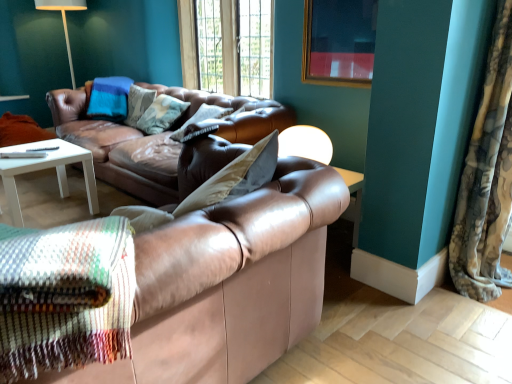
Identify the location of leather couch at center, marked as the 1th studio couch in a front-to-back arrangement. (229, 283).

Where is `fluffy fabric curtain at right`? This screenshot has height=384, width=512. fluffy fabric curtain at right is located at coordinates point(487,178).

The image size is (512, 384). Describe the element at coordinates (227, 46) in the screenshot. I see `wooden frame at upper center` at that location.

What do you see at coordinates (128, 152) in the screenshot?
I see `leather couch at center, which is the 1th studio couch from back to front` at bounding box center [128, 152].

At what (x,y) coordinates should I click in order to perform the action: click on gold-framed picture at upper center. Please return your answer as a coordinate pair (x, y). Looking at the image, I should click on (339, 42).

Describe the element at coordinates (201, 118) in the screenshot. The image size is (512, 384). I see `leather pillow at center` at that location.

Where is `matte white table lamp at center`? This screenshot has width=512, height=384. matte white table lamp at center is located at coordinates (305, 143).

Would you say leather couch at center, which ranks as the 2th studio couch in back-to-front order, is inside or outside fluffy fabric curtain at right?

leather couch at center, which ranks as the 2th studio couch in back-to-front order, is not enclosed by fluffy fabric curtain at right.

Does leather couch at center, which ranks as the 2th studio couch in back-to-front order, have a larger size compared to fluffy fabric curtain at right?

Yes.

Which of these two, leather couch at center, which ranks as the 2th studio couch in back-to-front order, or fluffy fabric curtain at right, stands taller?

fluffy fabric curtain at right is taller.

Is leather pillow at center completely or partially outside of leather couch at center, which ranks as the 2th studio couch in back-to-front order?

Yes, leather pillow at center is not within leather couch at center, which ranks as the 2th studio couch in back-to-front order.

Which of these two, leather pillow at center or leather couch at center, marked as the 1th studio couch in a front-to-back arrangement, stands taller?

leather couch at center, marked as the 1th studio couch in a front-to-back arrangement.

Is leather pillow at center thinner than leather couch at center, which ranks as the 2th studio couch in back-to-front order?

Indeed, leather pillow at center has a lesser width compared to leather couch at center, which ranks as the 2th studio couch in back-to-front order.

What's the angular difference between leather pillow at center and leather couch at center, marked as the 1th studio couch in a front-to-back arrangement,'s facing directions?

87 degrees.

Is leather couch at center, which is the 1th studio couch from back to front, at the back of leather couch at center, marked as the 1th studio couch in a front-to-back arrangement?

No.

Consider the image. Is leather couch at center, which ranks as the 2th studio couch in back-to-front order, beside leather couch at center, which is the 1th studio couch from back to front?

No, leather couch at center, which ranks as the 2th studio couch in back-to-front order, is not in contact with leather couch at center, which is the 1th studio couch from back to front.

Between leather couch at center, which ranks as the 2th studio couch in back-to-front order, and leather couch at center, which is the 1th studio couch from back to front, which one appears on the left side from the viewer's perspective?

leather couch at center, which is the 1th studio couch from back to front, is more to the left.

How distant is leather couch at center, marked as the 1th studio couch in a front-to-back arrangement, from leather couch at center, acting as the second studio couch starting from the front?

A distance of 1.02 meters exists between leather couch at center, marked as the 1th studio couch in a front-to-back arrangement, and leather couch at center, acting as the second studio couch starting from the front.

Considering the positions of objects wooden frame at upper center and leather couch at center, which ranks as the 2th studio couch in back-to-front order, in the image provided, who is more to the right, wooden frame at upper center or leather couch at center, which ranks as the 2th studio couch in back-to-front order,?

wooden frame at upper center.

Which object is wider, wooden frame at upper center or leather couch at center, marked as the 1th studio couch in a front-to-back arrangement?

leather couch at center, marked as the 1th studio couch in a front-to-back arrangement, is wider.

Are wooden frame at upper center and leather couch at center, which ranks as the 2th studio couch in back-to-front order, beside each other?

No.

What's the angular difference between wooden frame at upper center and leather couch at center, marked as the 1th studio couch in a front-to-back arrangement,'s facing directions?

The angle between the facing direction of wooden frame at upper center and the facing direction of leather couch at center, marked as the 1th studio couch in a front-to-back arrangement, is 89.4 degrees.

Is leather pillow at center oriented away from wooden frame at upper center?

Yes, leather pillow at center's orientation is away from wooden frame at upper center.

Find the location of a particular element. This screenshot has width=512, height=384. window located above the leather pillow at center (from a real-world perspective) is located at coordinates (227, 46).

Are leather pillow at center and wooden frame at upper center far apart?

Yes, leather pillow at center and wooden frame at upper center are located far from each other.

From a real-world perspective, who is located lower, gold-framed picture at upper center or wooden frame at upper center?

From a 3D spatial view, wooden frame at upper center is below.

Does gold-framed picture at upper center contain wooden frame at upper center?

No, wooden frame at upper center is located outside of gold-framed picture at upper center.

Considering the relative sizes of gold-framed picture at upper center and wooden frame at upper center in the image provided, is gold-framed picture at upper center thinner than wooden frame at upper center?

Correct, the width of gold-framed picture at upper center is less than that of wooden frame at upper center.

Is gold-framed picture at upper center facing towards wooden frame at upper center?

No, gold-framed picture at upper center is not aimed at wooden frame at upper center.

What's the angular difference between fluffy fabric curtain at right and leather couch at center, acting as the second studio couch starting from the front,'s facing directions?

3.2 degrees.

This screenshot has width=512, height=384. Identify the location of curtain above the leather couch at center, which is the 1th studio couch from back to front (from a real-world perspective). (487, 178).

Could leather couch at center, which is the 1th studio couch from back to front, be considered to be inside fluffy fabric curtain at right?

That's incorrect, leather couch at center, which is the 1th studio couch from back to front, is not inside fluffy fabric curtain at right.

Which object is more forward, fluffy fabric curtain at right or leather couch at center, which is the 1th studio couch from back to front?

fluffy fabric curtain at right is more forward.

Locate an element on the screen. This screenshot has width=512, height=384. curtain on the right side of leather couch at center, marked as the 1th studio couch in a front-to-back arrangement is located at coordinates (487, 178).

There is a leather pillow at center. Where is `the 2nd studio couch below it (from the image's perspective)`? The image size is (512, 384). the 2nd studio couch below it (from the image's perspective) is located at coordinates (229, 283).

Based on their spatial positions, is leather couch at center, marked as the 1th studio couch in a front-to-back arrangement, or fluffy fabric curtain at right further from matte white table lamp at center?

leather couch at center, marked as the 1th studio couch in a front-to-back arrangement, lies further to matte white table lamp at center than the other object.

Consider the image. Looking at the image, which one is located closer to fluffy fabric curtain at right, matte white table lamp at center or leather pillow at center?

Among the two, matte white table lamp at center is located nearer to fluffy fabric curtain at right.

Looking at the image, which one is located closer to leather couch at center, which is the 1th studio couch from back to front, fluffy fabric curtain at right or gold-framed picture at upper center?

Among the two, gold-framed picture at upper center is located nearer to leather couch at center, which is the 1th studio couch from back to front.

From the image, which object appears to be nearer to matte white table lamp at center, leather couch at center, acting as the second studio couch starting from the front, or leather pillow at center?

leather pillow at center lies closer to matte white table lamp at center than the other object.

From the image, which object appears to be farther from wooden frame at upper center, fluffy fabric curtain at right or leather couch at center, marked as the 1th studio couch in a front-to-back arrangement?

Based on the image, leather couch at center, marked as the 1th studio couch in a front-to-back arrangement, appears to be further to wooden frame at upper center.

Consider the image. When comparing their distances from fluffy fabric curtain at right, does wooden frame at upper center or leather pillow at center seem further?

wooden frame at upper center is positioned further to the anchor fluffy fabric curtain at right.

Looking at the image, which one is located closer to wooden frame at upper center, gold-framed picture at upper center or matte white table lamp at center?

The object closer to wooden frame at upper center is gold-framed picture at upper center.

From the image, which object appears to be farther from leather pillow at center, wooden frame at upper center or leather couch at center, which is the 1th studio couch from back to front?

The object further to leather pillow at center is wooden frame at upper center.

Identify the location of window located between leather couch at center, acting as the second studio couch starting from the front, and gold-framed picture at upper center in the left-right direction. (227, 46).

Image resolution: width=512 pixels, height=384 pixels. Identify the location of table lamp between leather couch at center, which ranks as the 2th studio couch in back-to-front order, and wooden frame at upper center from front to back. (305, 143).

At what (x,y) coordinates should I click in order to perform the action: click on pillow between leather couch at center, which ranks as the 2th studio couch in back-to-front order, and wooden frame at upper center, along the z-axis. Please return your answer as a coordinate pair (x, y). The width and height of the screenshot is (512, 384). Looking at the image, I should click on (201, 118).

What are the coordinates of `curtain between leather couch at center, which ranks as the 2th studio couch in back-to-front order, and wooden frame at upper center from front to back` in the screenshot? It's located at (487, 178).